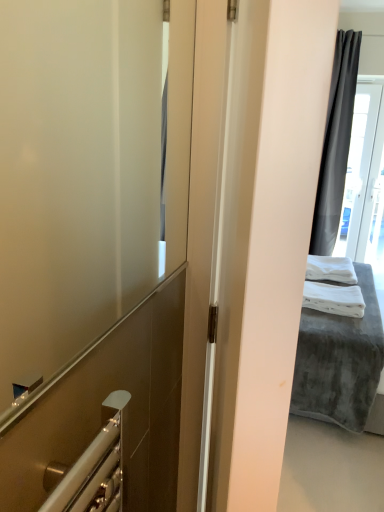
Question: Is white soft bath towel at right, which is the first bath towel in back-to-front order, to the left of transparent glass door at upper right from the viewer's perspective?

Choices:
 (A) no
 (B) yes

Answer: (B)

Question: Is white soft bath towel at right, the second bath towel positioned from the front, taller than transparent glass door at upper right?

Choices:
 (A) no
 (B) yes

Answer: (A)

Question: From the image's perspective, is white soft bath towel at right, which is the first bath towel in back-to-front order, above transparent glass door at upper right?

Choices:
 (A) yes
 (B) no

Answer: (B)

Question: Is white soft bath towel at right, which is the first bath towel in back-to-front order, far away from transparent glass door at upper right?

Choices:
 (A) no
 (B) yes

Answer: (B)

Question: From a real-world perspective, is white soft bath towel at right, the second bath towel positioned from the front, on transparent glass door at upper right?

Choices:
 (A) no
 (B) yes

Answer: (A)

Question: Can you confirm if white soft bath towel at right, which is the first bath towel in back-to-front order, is thinner than transparent glass door at upper right?

Choices:
 (A) no
 (B) yes

Answer: (A)

Question: Is white soft fabric bed at right positioned beyond the bounds of transparent glass door at upper right?

Choices:
 (A) no
 (B) yes

Answer: (B)

Question: Considering the relative sizes of white soft fabric bed at right and transparent glass door at upper right in the image provided, is white soft fabric bed at right shorter than transparent glass door at upper right?

Choices:
 (A) yes
 (B) no

Answer: (A)

Question: From a real-world perspective, is white soft fabric bed at right positioned over transparent glass door at upper right based on gravity?

Choices:
 (A) no
 (B) yes

Answer: (A)

Question: Is transparent glass door at upper right located within white soft fabric bed at right?

Choices:
 (A) no
 (B) yes

Answer: (A)

Question: Is white soft fabric bed at right facing towards transparent glass door at upper right?

Choices:
 (A) no
 (B) yes

Answer: (A)

Question: Is white soft fabric bed at right directly adjacent to transparent glass door at upper right?

Choices:
 (A) yes
 (B) no

Answer: (B)

Question: Is white soft towel at right, placed as the second bath towel when sorted from back to front, positioned in front of transparent glass door at upper right?

Choices:
 (A) yes
 (B) no

Answer: (A)